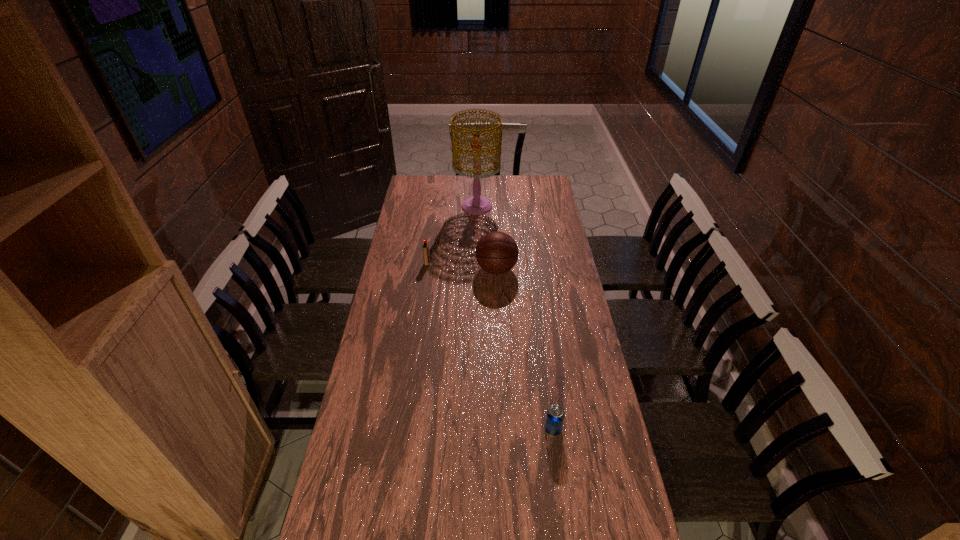
At what (x,y) coordinates should I click in order to perform the action: click on free spot located 0.220m on the left of the beer can. Please return your answer as a coordinate pair (x, y). This screenshot has height=540, width=960. Looking at the image, I should click on (470, 429).

At what (x,y) coordinates should I click in order to perform the action: click on object positioned at the far edge. Please return your answer as a coordinate pair (x, y). This screenshot has width=960, height=540. Looking at the image, I should click on (476, 205).

The width and height of the screenshot is (960, 540). I want to click on object that is at the left edge, so click(426, 255).

Image resolution: width=960 pixels, height=540 pixels. I want to click on object that is at the right edge, so click(555, 415).

The height and width of the screenshot is (540, 960). Identify the location of free space at the far edge. (493, 185).

I want to click on vacant space at the left edge of the desktop, so click(429, 220).

The height and width of the screenshot is (540, 960). What are the coordinates of `vacant area at the right edge` in the screenshot? It's located at (580, 339).

In the image, there is a desktop. Where is `vacant space at the far right corner`? The image size is (960, 540). vacant space at the far right corner is located at coordinates (540, 183).

Identify the location of unoccupied area between the third shortest object and the nearest object. (525, 349).

This screenshot has width=960, height=540. Find the location of `blank region between the igniter and the basketball`. blank region between the igniter and the basketball is located at coordinates (462, 266).